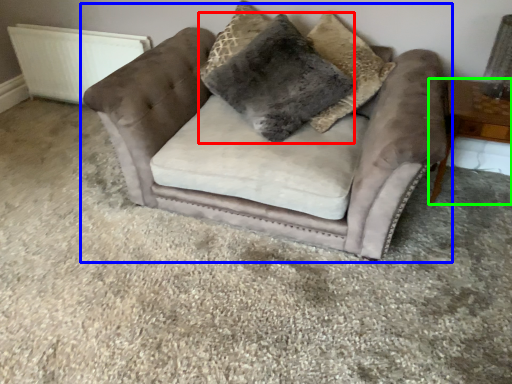
Question: Which object is the farthest from pillow (highlighted by a red box)? Choose among these: chair (highlighted by a blue box) or table (highlighted by a green box).

Choices:
 (A) chair
 (B) table

Answer: (B)